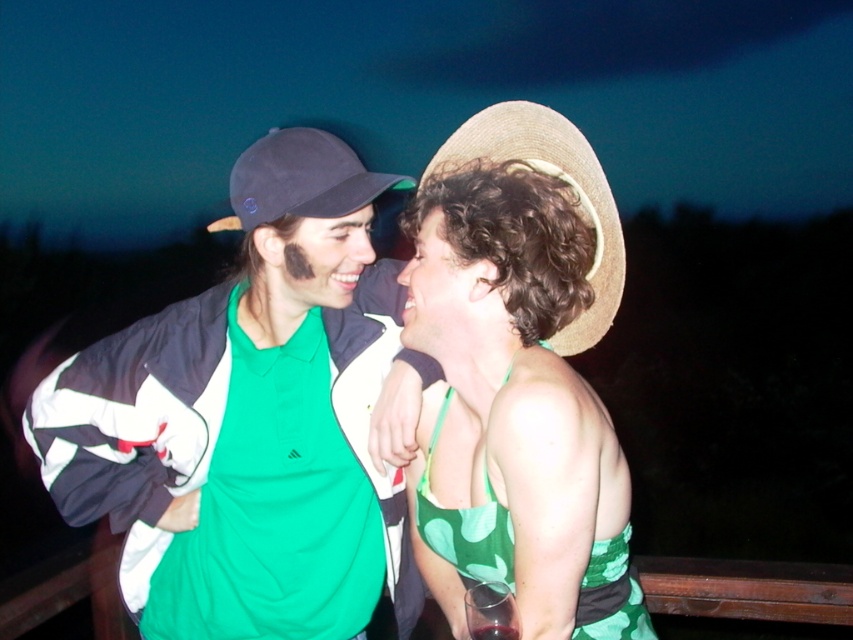
You are a photographer trying to capture both the green leafy fabric dress at center and the straw hat at right in a single frame. Given that the dress is smaller than the hat, how should you adjust your camera angle to ensure both are clearly visible?

Since the green leafy fabric dress at center is smaller than the straw hat at right, you should position your camera closer to the dress to magnify its size in the frame while keeping the hat in view to balance their sizes.

You are standing at the point marked as point (573, 268) in the image. The person on the left wearing a dark baseball cap and green polo shirt is facing you. Can you reach out and shake their hand without moving from your current position?

Yes, because the distance between you and the person is 1.38 meters, which is within a comfortable reach for a handshake.